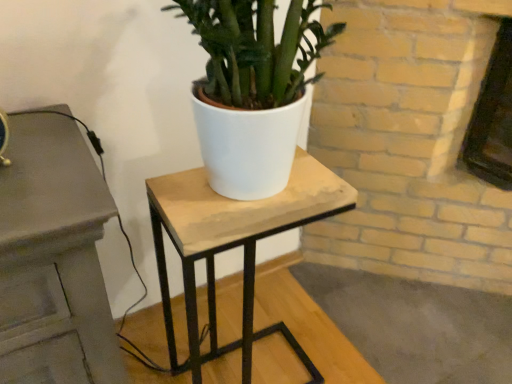
The height and width of the screenshot is (384, 512). What are the coordinates of `vacant area on the back side of wooden table at center` in the screenshot? It's located at (259, 303).